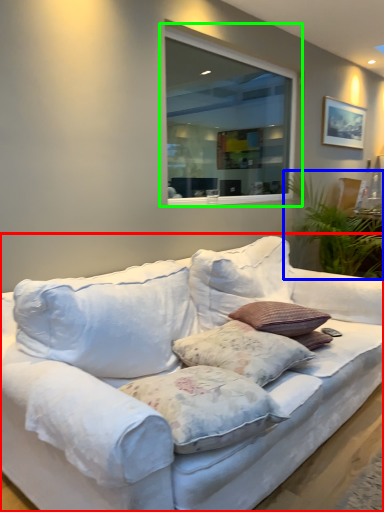
Question: Which object is positioned closest to studio couch (highlighted by a red box)? Select from plant (highlighted by a blue box) and window (highlighted by a green box).

Choices:
 (A) plant
 (B) window

Answer: (A)